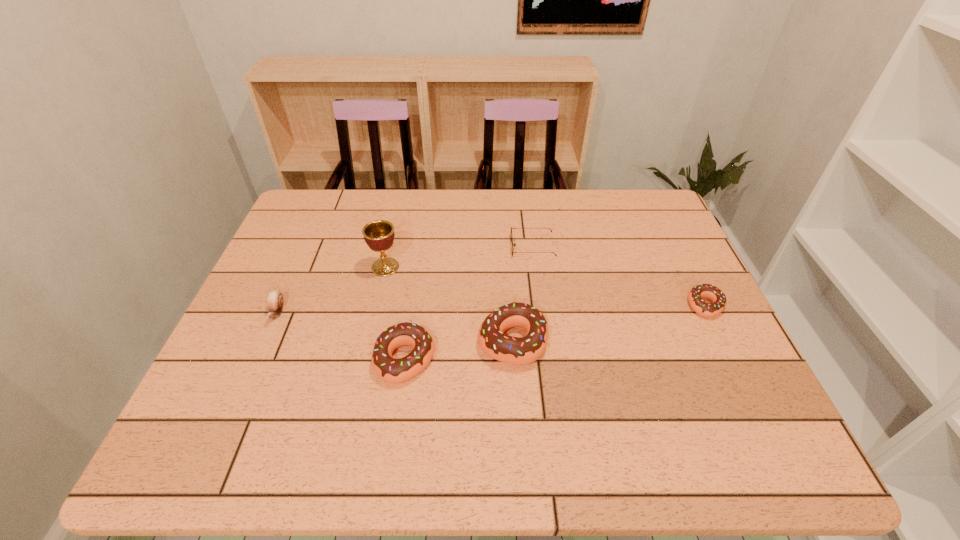
At what (x,y) coordinates should I click in order to perform the action: click on vacant space at the near edge. Please return your answer as a coordinate pair (x, y). This screenshot has height=540, width=960. Looking at the image, I should click on (280, 395).

The height and width of the screenshot is (540, 960). What are the coordinates of `blank space at the left edge of the desktop` in the screenshot? It's located at (248, 373).

Image resolution: width=960 pixels, height=540 pixels. I want to click on vacant space at the right edge, so (x=712, y=355).

This screenshot has width=960, height=540. Find the location of `vacant area at the far left corner of the desktop`. vacant area at the far left corner of the desktop is located at coordinates (307, 233).

The image size is (960, 540). Find the location of `free spot between the sunglasses and the leftmost doughnut`. free spot between the sunglasses and the leftmost doughnut is located at coordinates (468, 303).

Locate an element on the screen. The height and width of the screenshot is (540, 960). free point between the fourth tallest object and the chalice is located at coordinates (331, 290).

The height and width of the screenshot is (540, 960). I want to click on vacant space in between the sunglasses and the third shortest object, so click(x=405, y=280).

In order to click on free space that is in between the shortest doughnut and the second doughnut from left to right in this screenshot , I will do `click(609, 323)`.

Image resolution: width=960 pixels, height=540 pixels. Identify the location of empty space that is in between the sunglasses and the tallest object. (459, 257).

I want to click on vacant space in between the shortest doughnut and the leftmost doughnut, so (x=555, y=333).